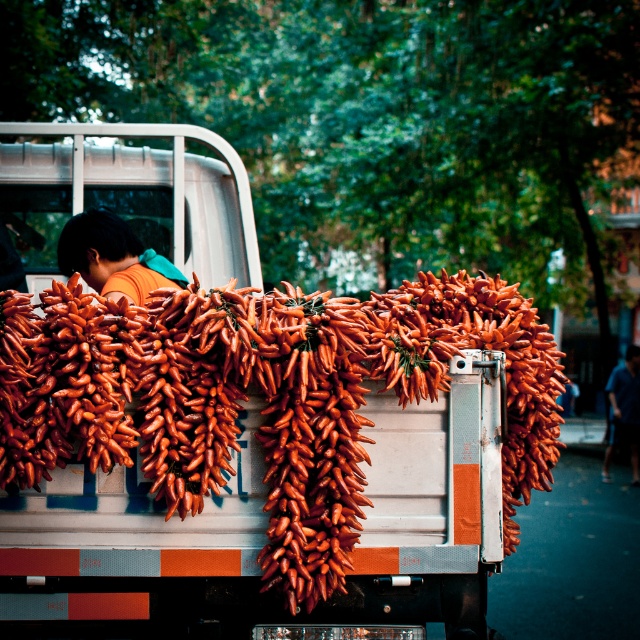
Can you confirm if matte orange carrots at center is positioned above blue fabric shirt at right?

Indeed, matte orange carrots at center is positioned over blue fabric shirt at right.

Does matte orange carrots at center have a smaller size compared to blue fabric shirt at right?

Yes.

Between point (77, 445) and point (616, 433), which one is positioned in front?

Point (77, 445) is in front.

At what (x,y) coordinates should I click in order to perform the action: click on matte orange carrots at center. Please return your answer as a coordinate pair (x, y). The image size is (640, 640). Looking at the image, I should click on (234, 436).

Does point (76, 269) come farther from viewer compared to point (634, 477)?

No.

At what (x,y) coordinates should I click in order to perform the action: click on orange matte shirt at center. Please return your answer as a coordinate pair (x, y). The width and height of the screenshot is (640, 640). Looking at the image, I should click on (113, 257).

Find the location of `orange matte shirt at center`. orange matte shirt at center is located at coordinates (113, 257).

Which is behind, point (452, 500) or point (104, 262)?

Point (104, 262)

Is matte orange carrots at center positioned behind orange matte shirt at center?

No, matte orange carrots at center is in front of orange matte shirt at center.

Is point (465, 282) closer to camera compared to point (145, 296)?

No, it is behind (145, 296).

The width and height of the screenshot is (640, 640). What are the coordinates of `matte orange carrots at center` in the screenshot? It's located at (x=234, y=436).